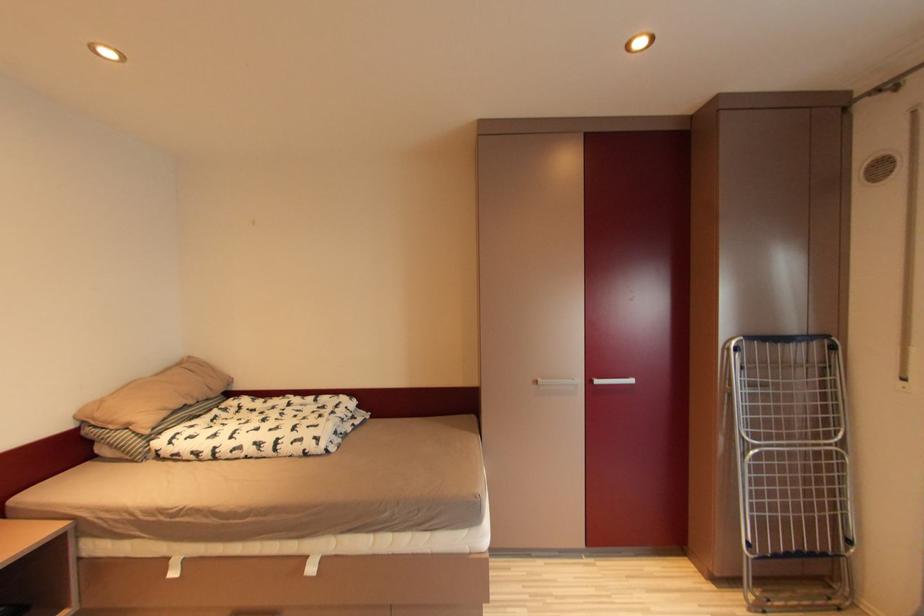
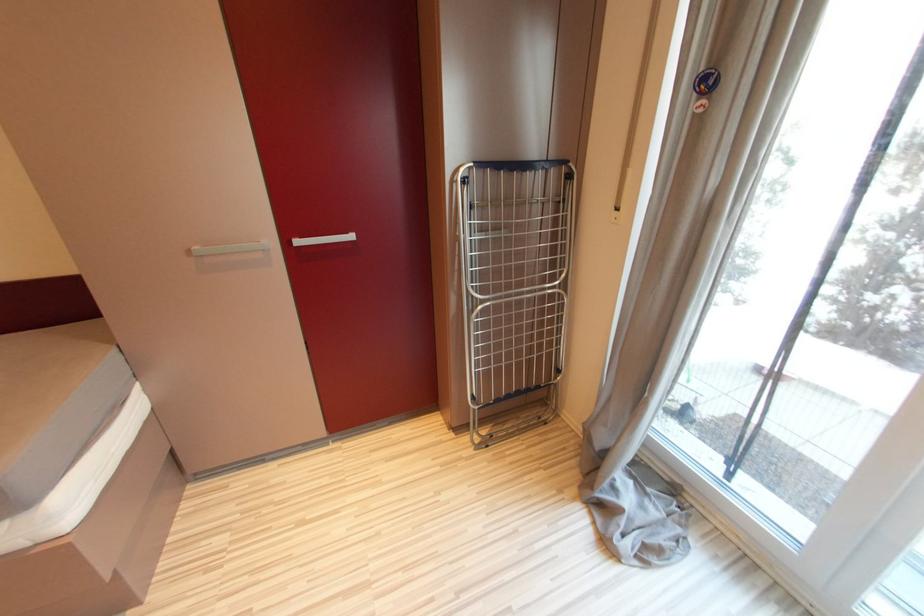
The images are taken continuously from a first-person perspective. In which direction is your viewpoint rotating?

The rotation direction of the camera is right-down.